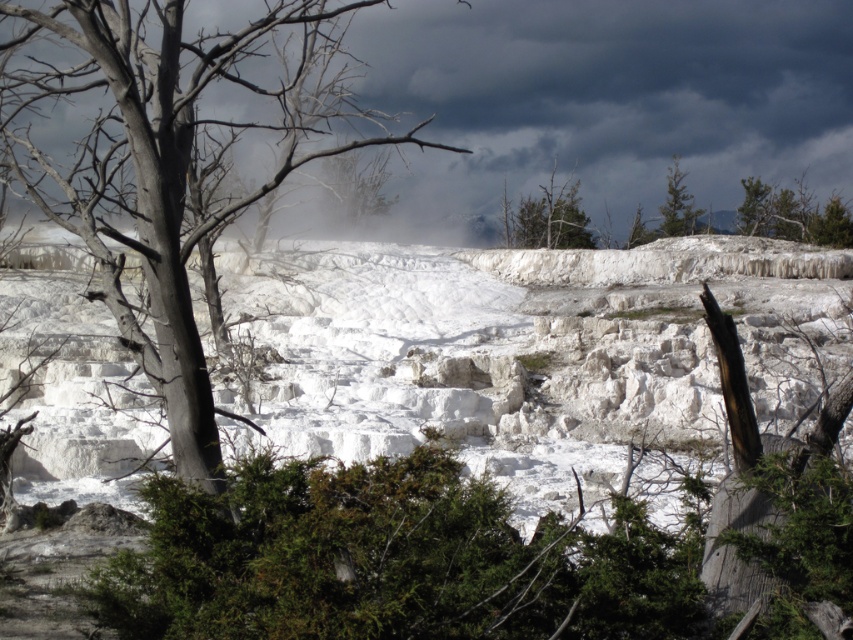
Is green matte tree at center below green textured pine tree at upper right?

Yes, green matte tree at center is below green textured pine tree at upper right.

Who is taller, green matte tree at center or green textured pine tree at upper right?

With more height is green matte tree at center.

Identify the location of green matte tree at center. (354, 186).

At what (x,y) coordinates should I click in order to perform the action: click on green matte tree at center. Please return your answer as a coordinate pair (x, y). Image resolution: width=853 pixels, height=640 pixels. Looking at the image, I should click on (354, 186).

From the picture: Does green matte tree at center appear under green leafy tree at upper center?

Actually, green matte tree at center is above green leafy tree at upper center.

Looking at this image, is green matte tree at center closer to camera compared to green leafy tree at upper center?

Yes, green matte tree at center is closer to the viewer.

Which is behind, point (349, 156) or point (553, 234)?

The point (349, 156) is more distant.

Where is `green matte tree at center`? This screenshot has width=853, height=640. green matte tree at center is located at coordinates (354, 186).

Who is positioned more to the right, white limestone terraces at center or green matte tree at center?

white limestone terraces at center

Can you confirm if white limestone terraces at center is positioned to the left of green matte tree at center?

In fact, white limestone terraces at center is to the right of green matte tree at center.

Does point (190, 580) come closer to viewer compared to point (341, 214)?

Yes.

Locate an element on the screen. The height and width of the screenshot is (640, 853). white limestone terraces at center is located at coordinates (445, 440).